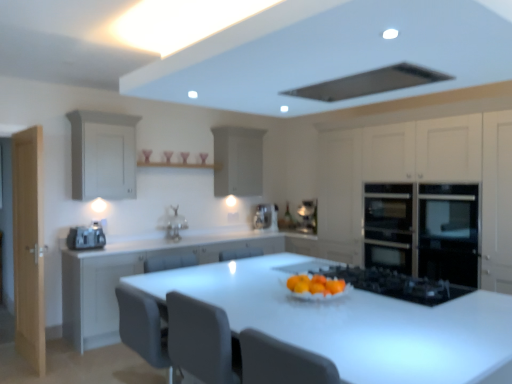
Question: Is matte white cabinet at left, the 1th cabinetry viewed from the left, facing away from light wood door at left?

Choices:
 (A) no
 (B) yes

Answer: (A)

Question: Does matte white cabinet at left, the 1th cabinetry viewed from the left, have a greater width compared to light wood door at left?

Choices:
 (A) no
 (B) yes

Answer: (B)

Question: Can you confirm if matte white cabinet at left, arranged as the 4th cabinetry when viewed from the right, is smaller than light wood door at left?

Choices:
 (A) yes
 (B) no

Answer: (A)

Question: Is matte white cabinet at left, arranged as the 4th cabinetry when viewed from the right, to the left of light wood door at left from the viewer's perspective?

Choices:
 (A) no
 (B) yes

Answer: (A)

Question: From a real-world perspective, is matte white cabinet at left, the 1th cabinetry viewed from the left, on top of light wood door at left?

Choices:
 (A) yes
 (B) no

Answer: (A)

Question: From a real-world perspective, is light wood door at left above or below satin silver coffee machine at center?

Choices:
 (A) above
 (B) below

Answer: (B)

Question: Is light wood door at left taller or shorter than satin silver coffee machine at center?

Choices:
 (A) short
 (B) tall

Answer: (B)

Question: From the image's perspective, is light wood door at left located above or below satin silver coffee machine at center?

Choices:
 (A) above
 (B) below

Answer: (B)

Question: In the image, is light wood door at left positioned in front of or behind satin silver coffee machine at center?

Choices:
 (A) behind
 (B) front

Answer: (B)

Question: Considering the positions of black stainless steel oven at right and satin silver toaster at left in the image, is black stainless steel oven at right wider or thinner than satin silver toaster at left?

Choices:
 (A) wide
 (B) thin

Answer: (A)

Question: Is black stainless steel oven at right in front of or behind satin silver toaster at left in the image?

Choices:
 (A) behind
 (B) front

Answer: (B)

Question: Is black stainless steel oven at right taller or shorter than satin silver toaster at left?

Choices:
 (A) tall
 (B) short

Answer: (A)

Question: From the image's perspective, relative to satin silver toaster at left, is black stainless steel oven at right above or below?

Choices:
 (A) above
 (B) below

Answer: (A)

Question: From a real-world perspective, is white matte cabinet at center, which appears as the 2th cabinetry when viewed from the left, positioned above or below black stainless steel oven at right?

Choices:
 (A) above
 (B) below

Answer: (B)

Question: Considering the relative positions of white matte cabinet at center, which ranks as the third cabinetry in right-to-left order, and black stainless steel oven at right in the image provided, is white matte cabinet at center, which ranks as the third cabinetry in right-to-left order, to the left or to the right of black stainless steel oven at right?

Choices:
 (A) right
 (B) left

Answer: (B)